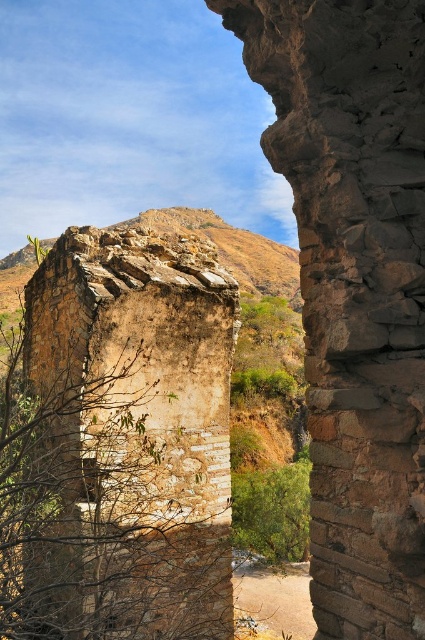
You are standing 2 meters away from the brown rough stone wall at center. A friend is standing 2.96 meters behind you. How far apart are you and your friend from the wall?

You are 2 meters away from the brown rough stone wall at center, and your friend is 2.96 meters behind you, so the total distance between you and your friend from the wall is 4.96 meters.

Based on the photo, based on the scene description, where is the brown rough stone wall at center located in terms of its 2D coordinates?

The brown rough stone wall at center is located at the 2D coordinates point (354, 288).